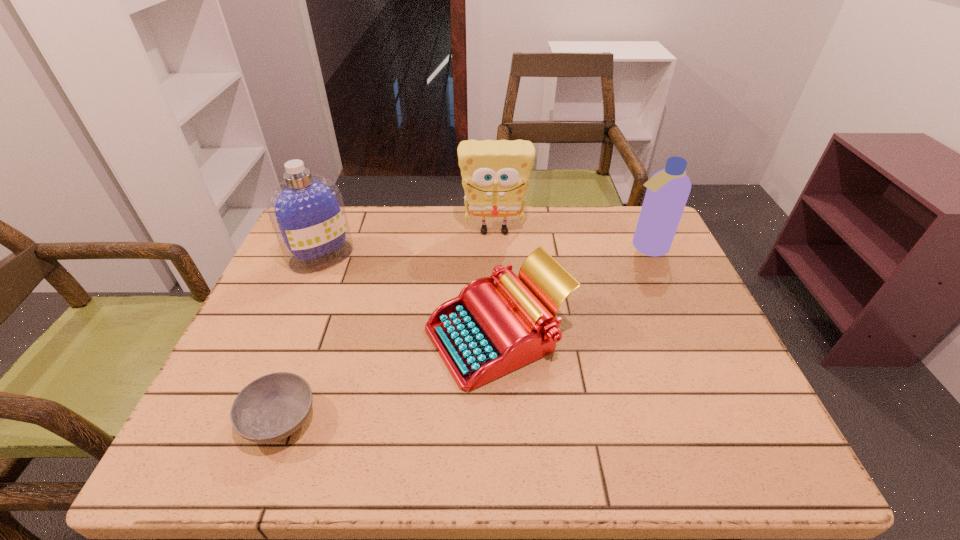
Identify the location of object at the near left corner. (272, 407).

This screenshot has height=540, width=960. I want to click on object present at the far right corner, so click(x=667, y=192).

Locate an element on the screen. The image size is (960, 540). blank space at the far edge of the desktop is located at coordinates (403, 209).

You are a GUI agent. You are given a task and a screenshot of the screen. Output one action in this format:
    pyautogui.click(x=<x>, y=<y>)
    Task: Click on the vacant space at the near edge of the desktop
    The width and height of the screenshot is (960, 540).
    Given the screenshot: What is the action you would take?
    pyautogui.click(x=627, y=451)

The width and height of the screenshot is (960, 540). What are the coordinates of `vacant space at the left edge` in the screenshot? It's located at (280, 340).

Image resolution: width=960 pixels, height=540 pixels. Identify the location of blank space at the near left corner of the desktop. 221,427.

This screenshot has width=960, height=540. What are the coordinates of `free spot at the near right corner of the desktop` in the screenshot? It's located at (771, 457).

I want to click on free space between the rightmost object and the cleansing agent, so click(484, 252).

Identify the location of free space between the typewriter and the shortest object. The image size is (960, 540). (389, 378).

At what (x,y) coordinates should I click in order to perform the action: click on vacant point located between the shortest object and the cleansing agent. Please return your answer as a coordinate pair (x, y). Looking at the image, I should click on 300,338.